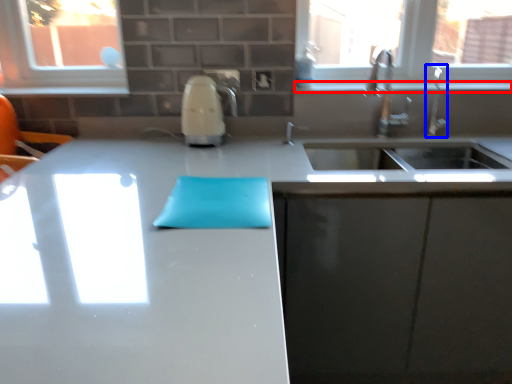
Question: Which point is closer to the camera, window sill (highlighted by a red box) or faucet (highlighted by a blue box)?

Choices:
 (A) window sill
 (B) faucet

Answer: (B)